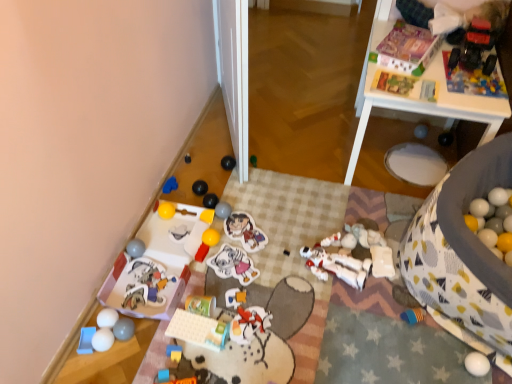
Find the location of a particular element. vacant space in between yellow matte ball at center, arranged as the 14th toy when viewed from the right, and rubber yellow block at lower center, marked as the eleventh toy in a left-to-right arrangement is located at coordinates (193, 274).